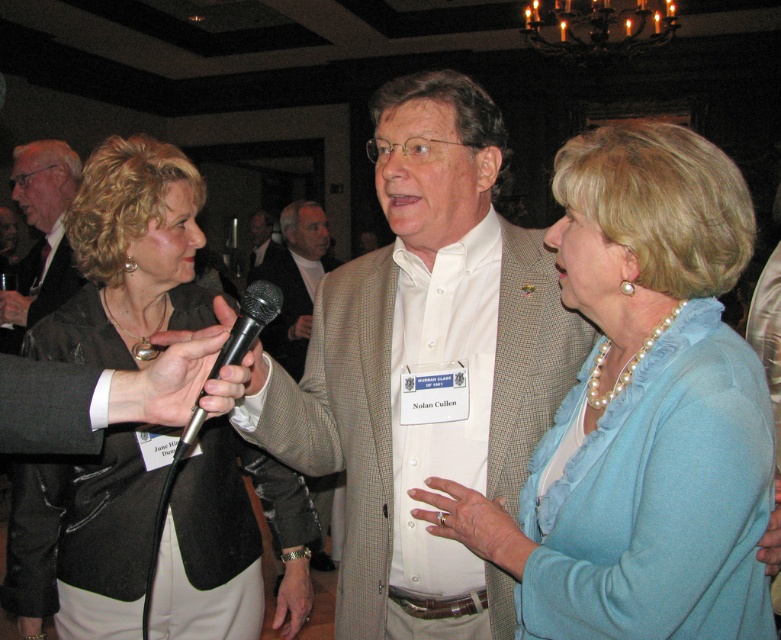
Question: Where is light brown textured blazer at center located in relation to black plastic microphone at center in the image?

Choices:
 (A) right
 (B) left

Answer: (B)

Question: Can you confirm if pearl necklace at center is wider than black suit jacket at upper left?

Choices:
 (A) yes
 (B) no

Answer: (B)

Question: Which object appears closest to the camera in this image?

Choices:
 (A) black suit jacket at upper left
 (B) black leather jacket at left

Answer: (B)

Question: Can you confirm if white shirt at center is positioned to the left of black suit jacket at upper left?

Choices:
 (A) no
 (B) yes

Answer: (A)

Question: Among these points, which one is farthest from the camera?

Choices:
 (A) [x=216, y=586]
 (B) [x=280, y=346]
 (C) [x=209, y=372]

Answer: (B)

Question: Which point is farther to the camera?

Choices:
 (A) pearl necklace at center
 (B) black plastic microphone at center
 (C) light brown textured blazer at center

Answer: (C)